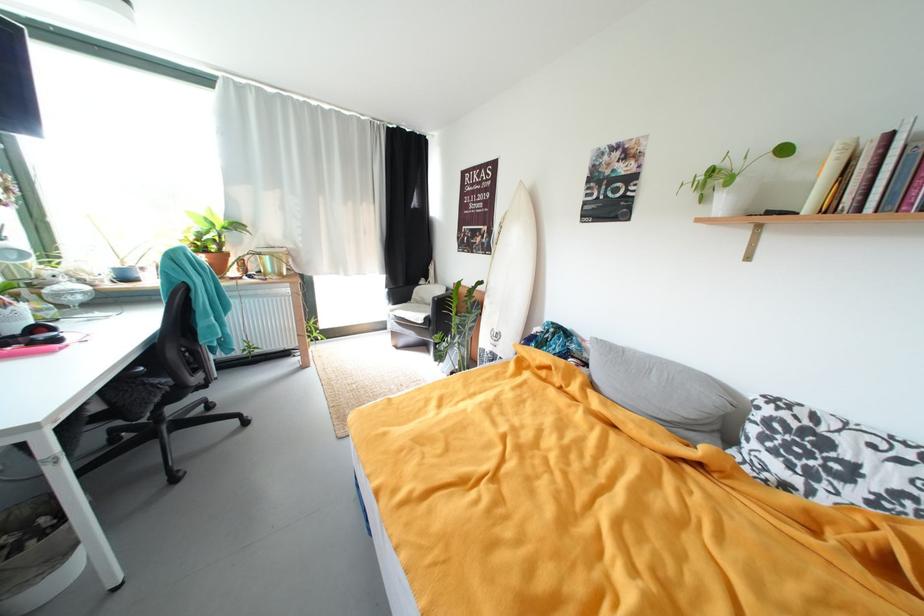
Describe the element at coordinates (508, 280) in the screenshot. This screenshot has width=924, height=616. I see `the white surfboard` at that location.